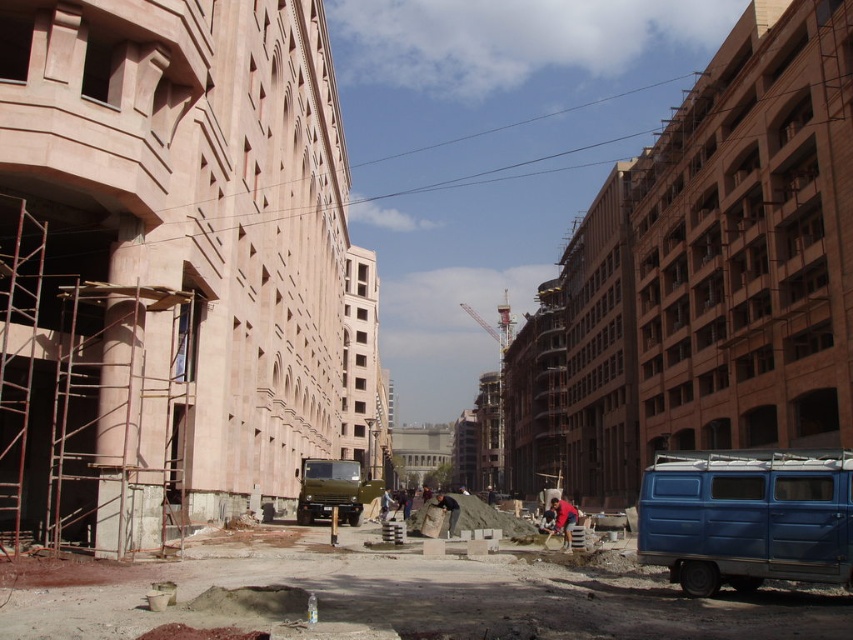
You are standing at the construction site and want to know which of the two points, point [724,481] or point [566,520], is nearer to you. Can you determine this based on the scene?

Point [724,481] is closer to the camera than point [566,520], so it is nearer to you.